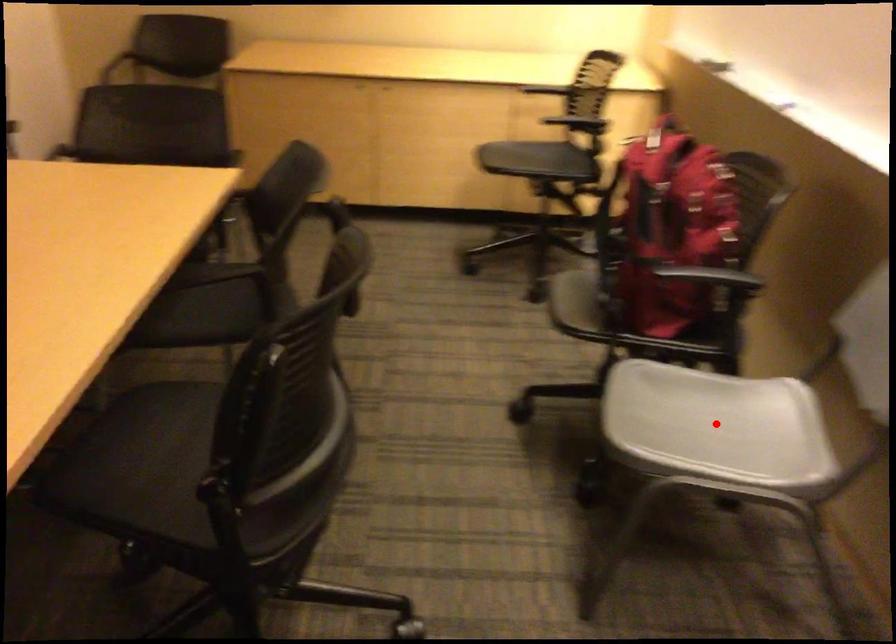
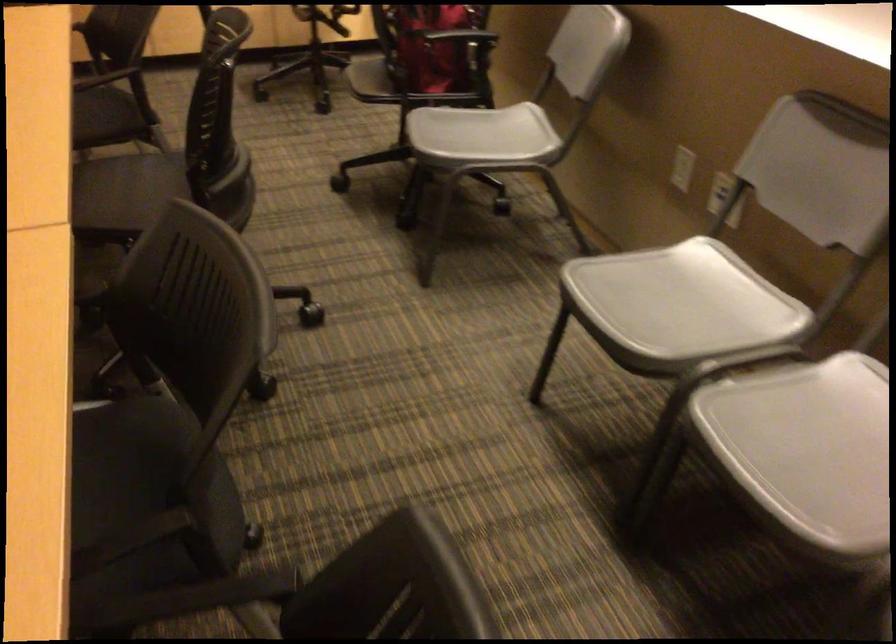
Question: A red point is marked in image1. In image2, is the corresponding 3D point closer to the camera or farther? Reply with the corresponding letter.

Choices:
 (A) The corresponding 3D point is closer.
 (B) The corresponding 3D point is farther.

Answer: (B)